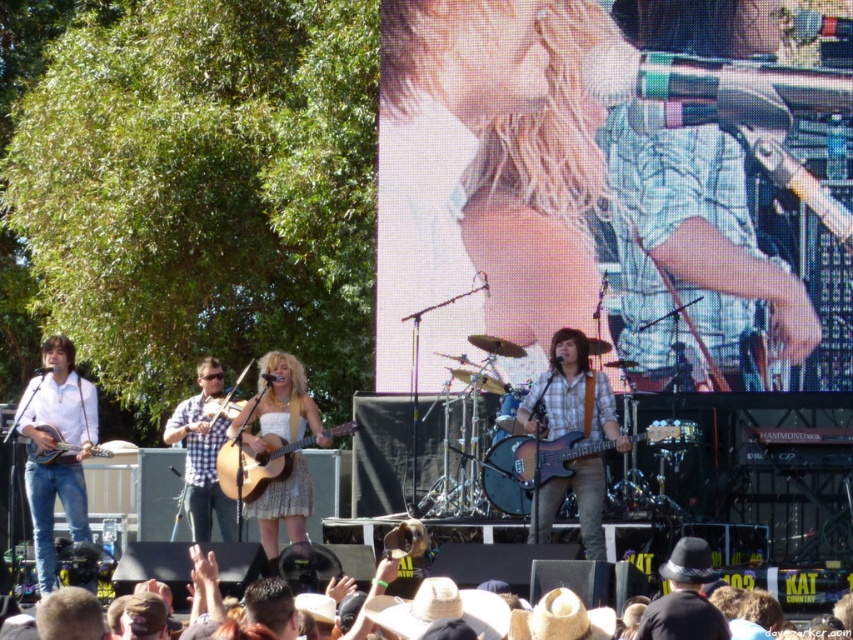
Which of these two, plaid fabric guitar at center or wooden acoustic guitar at center, stands shorter?

With less height is plaid fabric guitar at center.

Does plaid fabric guitar at center appear on the right side of wooden acoustic guitar at center?

Indeed, plaid fabric guitar at center is positioned on the right side of wooden acoustic guitar at center.

Is point (563, 387) behind point (291, 445)?

That is False.

In order to click on plaid fabric guitar at center in this screenshot , I will do `click(572, 396)`.

You are a GUI agent. You are given a task and a screenshot of the screen. Output one action in this format:
    pyautogui.click(x=<x>, y=<y>)
    Task: Click on the brown straw hats at lower center
    The image size is (853, 640).
    Given the screenshot: What is the action you would take?
    pyautogui.click(x=811, y=588)

Is brown straw hats at lower center smaller than glossy wood guitar at center?

No.

Between point (585, 586) and point (653, 438), which one is positioned in front?

Point (585, 586) is in front.

Where is `brown straw hats at lower center`? This screenshot has width=853, height=640. brown straw hats at lower center is located at coordinates (811, 588).

Is plaid fabric guitar at center thinner than matte brown acoustic guitar at lower left?

Correct, plaid fabric guitar at center's width is less than matte brown acoustic guitar at lower left's.

Which of these two, plaid fabric guitar at center or matte brown acoustic guitar at lower left, stands taller?

With more height is matte brown acoustic guitar at lower left.

Is point (537, 516) closer to viewer compared to point (61, 454)?

Yes, point (537, 516) is closer to viewer.

Where is `plaid fabric guitar at center`? The height and width of the screenshot is (640, 853). plaid fabric guitar at center is located at coordinates (572, 396).